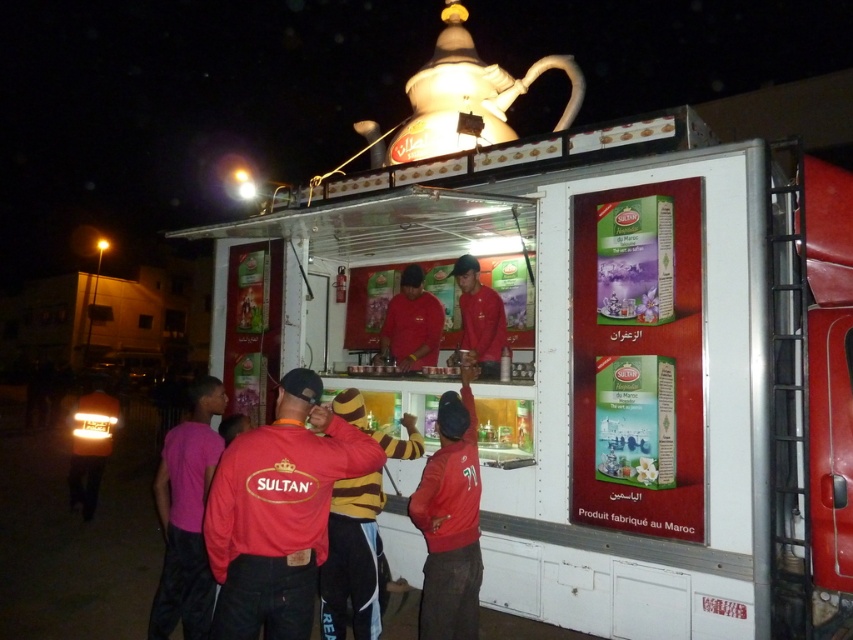
Question: Is white plastic trailer truck at center below red matte jacket at center?

Choices:
 (A) no
 (B) yes

Answer: (A)

Question: Among these points, which one is nearest to the camera?

Choices:
 (A) (383, 449)
 (B) (465, 140)

Answer: (A)

Question: Estimate the real-world distances between objects in this image. Which object is closer to the red matte uniform at center?

Choices:
 (A) red matte jacket at center
 (B) matte red shirt at center
 (C) white plastic trailer truck at center
 (D) pink fabric shirt at lower left

Answer: (B)

Question: Can you confirm if white plastic trailer truck at center is thinner than red matte uniform at center?

Choices:
 (A) no
 (B) yes

Answer: (A)

Question: Which object is the farthest from the red matte uniform at center?

Choices:
 (A) pink fabric shirt at lower left
 (B) white matte teapot at upper center
 (C) white plastic trailer truck at center
 (D) matte red jacket at center

Answer: (A)

Question: Can you confirm if red matte uniform at center is bigger than matte red shirt at center?

Choices:
 (A) yes
 (B) no

Answer: (B)